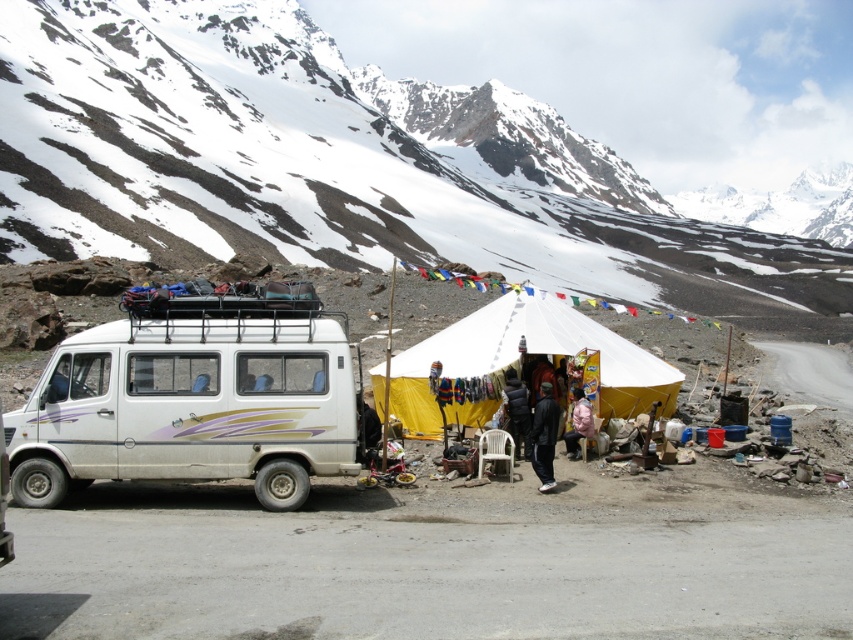
Which is more to the right, white matte van at left or black fuzzy jacket at center?

Positioned to the right is black fuzzy jacket at center.

Does point (277, 449) come farther from viewer compared to point (508, 381)?

No.

Who is more forward, (6, 432) or (509, 433)?

Point (6, 432) is more forward.

Identify the location of white matte van at left. Image resolution: width=853 pixels, height=640 pixels. tap(190, 404).

This screenshot has height=640, width=853. Describe the element at coordinates (341, 164) in the screenshot. I see `white snow-covered mountain at upper center` at that location.

Does white snow-covered mountain at upper center appear over pink fabric person at center?

Yes.

The height and width of the screenshot is (640, 853). Describe the element at coordinates (341, 164) in the screenshot. I see `white snow-covered mountain at upper center` at that location.

This screenshot has width=853, height=640. In order to click on white snow-covered mountain at upper center in this screenshot , I will do [x=341, y=164].

Is point (321, 124) closer to viewer compared to point (550, 461)?

No, (321, 124) is behind (550, 461).

Does white snow-covered mountain at upper center appear on the left side of black leather jacket at center?

No, white snow-covered mountain at upper center is not to the left of black leather jacket at center.

This screenshot has width=853, height=640. What do you see at coordinates (341, 164) in the screenshot?
I see `white snow-covered mountain at upper center` at bounding box center [341, 164].

You are a GUI agent. You are given a task and a screenshot of the screen. Output one action in this format:
    pyautogui.click(x=<x>, y=<y>)
    Task: Click on the white snow-covered mountain at upper center
    This screenshot has width=853, height=640.
    Given the screenshot: What is the action you would take?
    pyautogui.click(x=341, y=164)